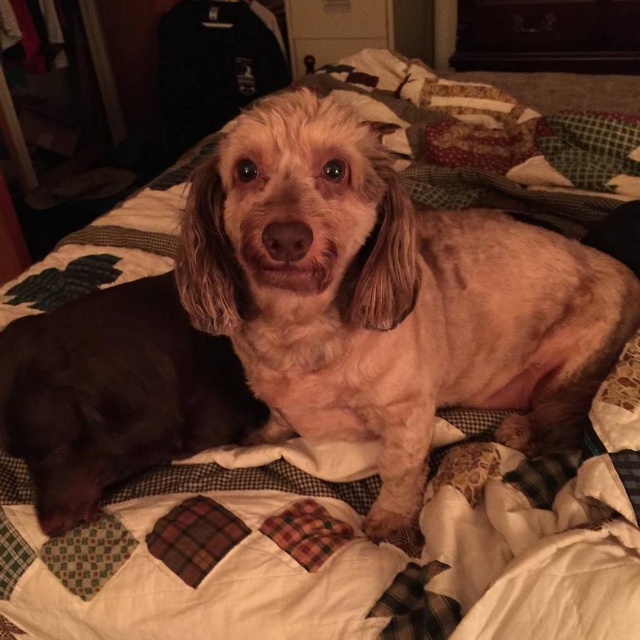
Question: Is fuzzy brown dog at center behind brown fur dog at center?

Choices:
 (A) yes
 (B) no

Answer: (B)

Question: Which point is closer to the camera taking this photo?

Choices:
 (A) (48, 368)
 (B) (449, 234)

Answer: (A)

Question: Can you confirm if fuzzy brown dog at center is positioned to the left of brown fur dog at center?

Choices:
 (A) yes
 (B) no

Answer: (B)

Question: Does fuzzy brown dog at center appear on the right side of brown fur dog at center?

Choices:
 (A) yes
 (B) no

Answer: (A)